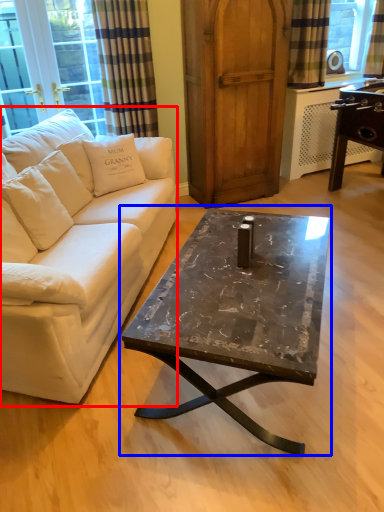
Question: Among these objects, which one is nearest to the camera, studio couch (highlighted by a red box) or coffee table (highlighted by a blue box)?

Choices:
 (A) studio couch
 (B) coffee table

Answer: (A)